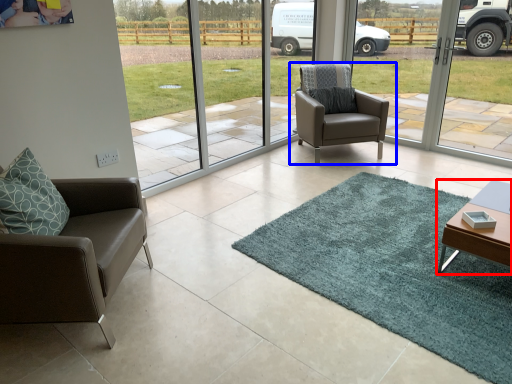
Question: Among these objects, which one is farthest to the camera, table (highlighted by a red box) or chair (highlighted by a blue box)?

Choices:
 (A) table
 (B) chair

Answer: (B)